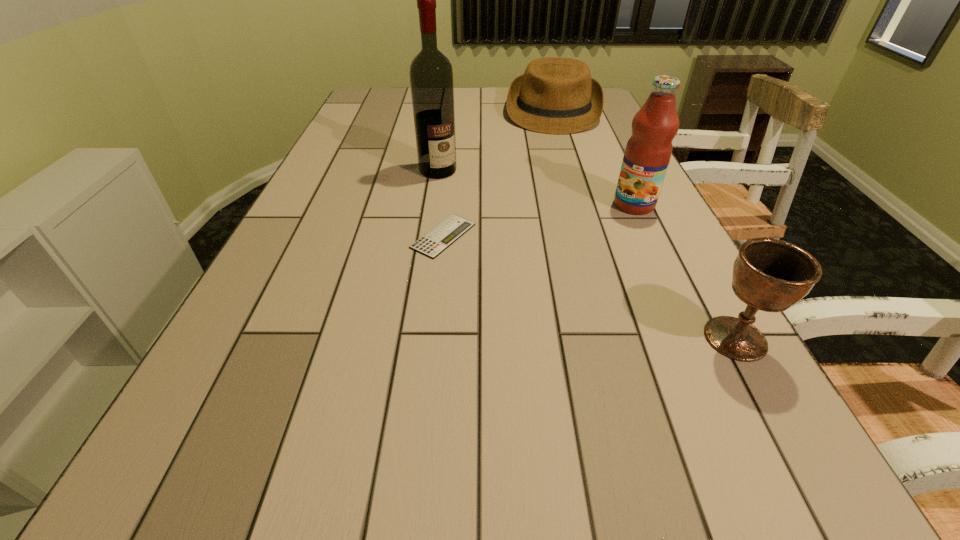
Where is `free space that is in between the fruit juice and the shortest object`? The height and width of the screenshot is (540, 960). free space that is in between the fruit juice and the shortest object is located at coordinates (539, 220).

Where is `free space between the fruit juice and the nearest object`? The height and width of the screenshot is (540, 960). free space between the fruit juice and the nearest object is located at coordinates (684, 272).

This screenshot has width=960, height=540. In order to click on free space between the fruit juice and the chalice in this screenshot , I will do `click(684, 272)`.

I want to click on vacant space that's between the chalice and the farthest object, so click(644, 225).

Where is `empty location between the chalice and the shortest object`? This screenshot has width=960, height=540. empty location between the chalice and the shortest object is located at coordinates (589, 287).

In order to click on free spot between the fourth shortest object and the farthest object in this screenshot , I will do `click(593, 158)`.

Locate an element on the screen. empty space that is in between the fruit juice and the nearest object is located at coordinates (684, 272).

Image resolution: width=960 pixels, height=540 pixels. In order to click on the closest object to the fourth tallest object in this screenshot , I will do `click(431, 75)`.

Identify which object is the third nearest to the nearest object. Please provide its 2D coordinates. Your answer should be formatted as a tuple, i.e. [(x, y)], where the tuple contains the x and y coordinates of a point satisfying the conditions above.

[(431, 75)]

Find the location of `free space that satisfies the following two spatial constraints: 1. on the front side of the chalice; 2. on the right side of the second tallest object`. free space that satisfies the following two spatial constraints: 1. on the front side of the chalice; 2. on the right side of the second tallest object is located at coordinates (697, 339).